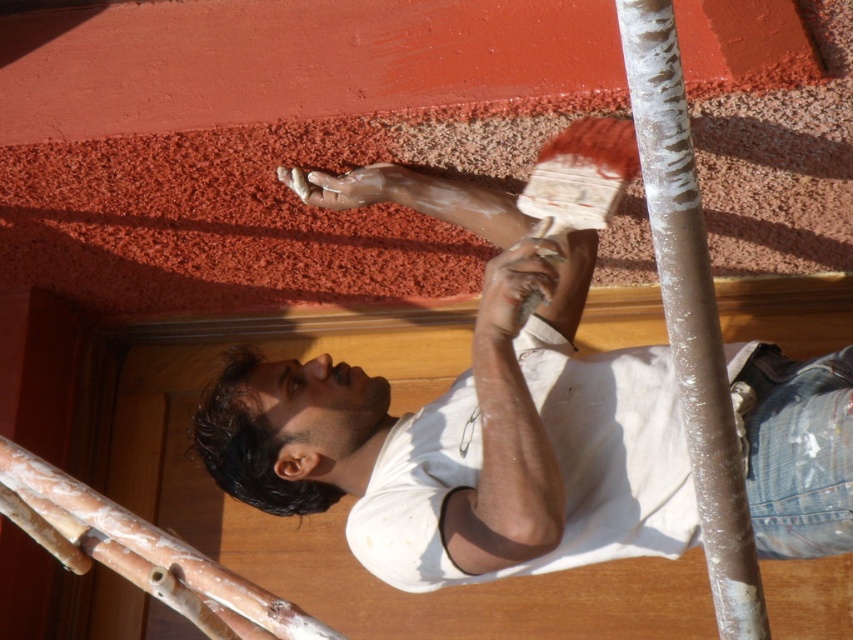
Between white matte shirt at center and white textured pole at right, which one is positioned lower?

white matte shirt at center

Is point (544, 552) in front of point (727, 419)?

No, it is behind (727, 419).

Find the location of a particular element. white matte shirt at center is located at coordinates 466,420.

Between point (560, 486) and point (625, 120), which one is positioned in front?

Point (560, 486)

Which is above, white matte shirt at center or white textured paintbrush at upper center?

white textured paintbrush at upper center is above.

Locate an element on the screen. The width and height of the screenshot is (853, 640). white matte shirt at center is located at coordinates (466, 420).

You are a GUI agent. You are given a task and a screenshot of the screen. Output one action in this format:
    pyautogui.click(x=<x>, y=<y>)
    Task: Click on the white matte shirt at center
    The width and height of the screenshot is (853, 640).
    Given the screenshot: What is the action you would take?
    (x=466, y=420)

Who is more forward, (680, 260) or (578, 172)?

Point (680, 260) is more forward.

Is white textured pole at right wider than white textured paintbrush at upper center?

No.

Does point (706, 486) come behind point (625, 141)?

No, (706, 486) is closer to viewer.

I want to click on white textured pole at right, so click(691, 310).